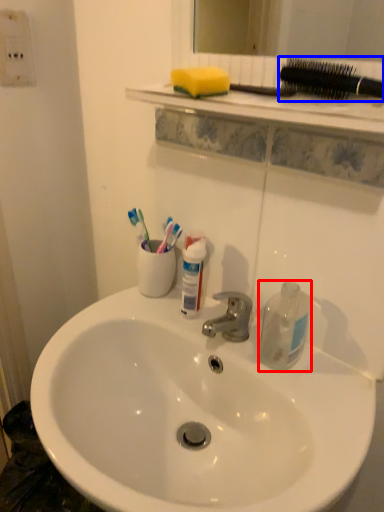
Question: Which object is further to the camera taking this photo, cleaning product (highlighted by a red box) or brush (highlighted by a blue box)?

Choices:
 (A) cleaning product
 (B) brush

Answer: (A)